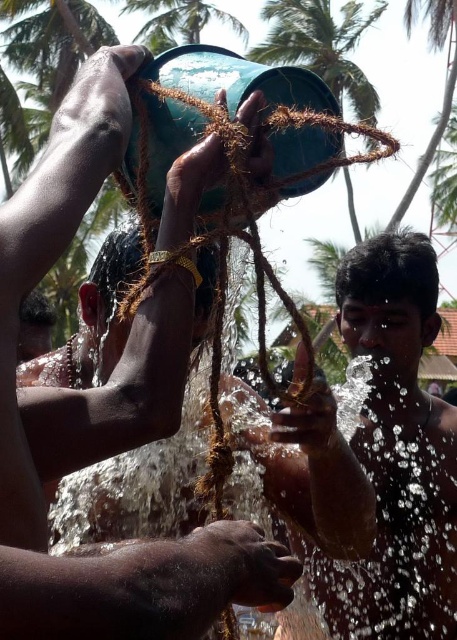
You are a photographer trying to capture a closeup of both the glossy brown hair at center and the green matte palm tree at upper center in the scene. Given their distance apart, do you think you can fit both into a single frame without moving your camera position?

The glossy brown hair at center and the green matte palm tree at upper center are 45.18 feet apart. Depending on the camera lens and framing, it might be challenging to capture both in a single frame without moving the camera, as they are quite far apart.